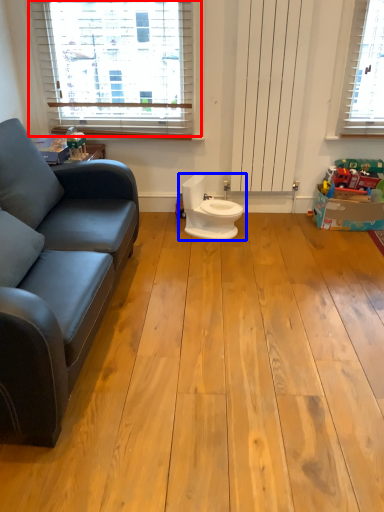
Question: Which point is further to the camera, window (highlighted by a red box) or toilet (highlighted by a blue box)?

Choices:
 (A) window
 (B) toilet

Answer: (A)